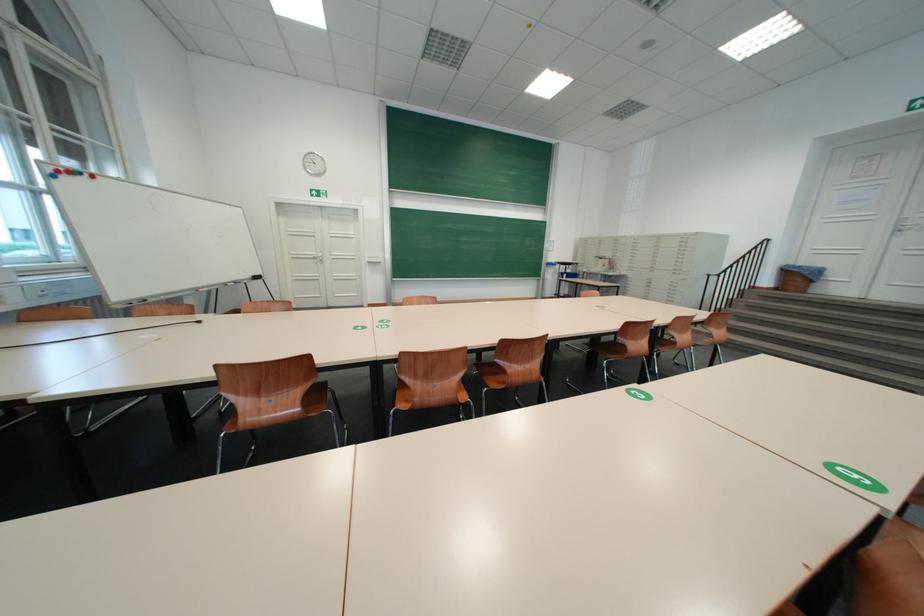
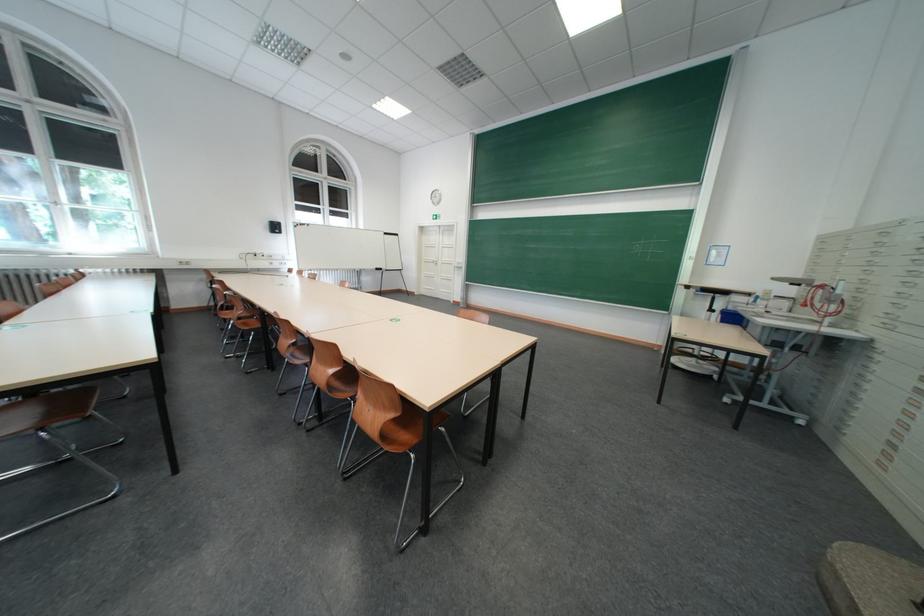
Question: I am providing you with two images of the same scene from different viewpoints. Which of the following objects are not visible in image2?

Choices:
 (A) brown chair sitting surface
 (B) blue plastic bin
 (C) green spatula
 (D) white door handle

Answer: (A)